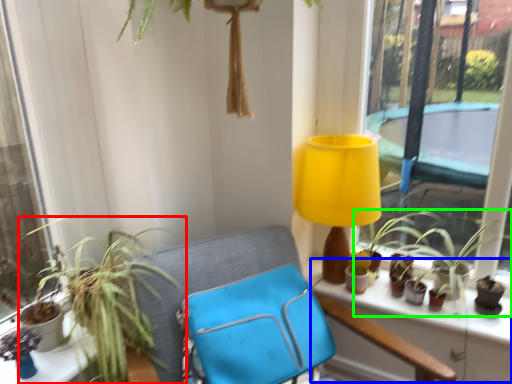
Question: Which object is the closest to the houseplant (highlighted by a red box)? Choose among these: window sill (highlighted by a blue box) or houseplant (highlighted by a green box).

Choices:
 (A) window sill
 (B) houseplant

Answer: (A)